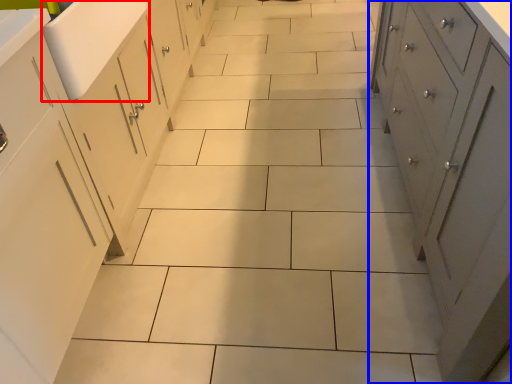
Question: Which object appears farthest to the camera in this image, sink (highlighted by a red box) or cupboard (highlighted by a blue box)?

Choices:
 (A) sink
 (B) cupboard

Answer: (A)